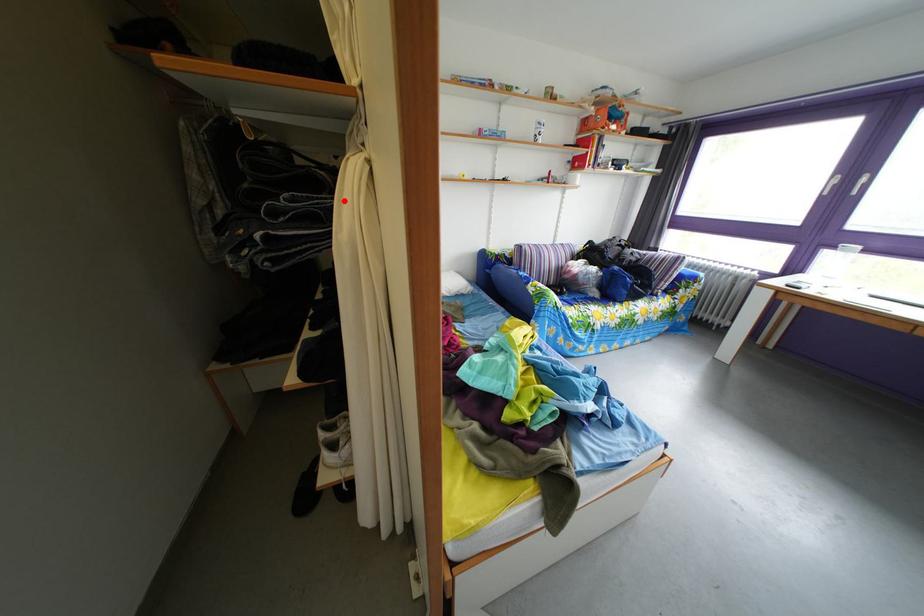
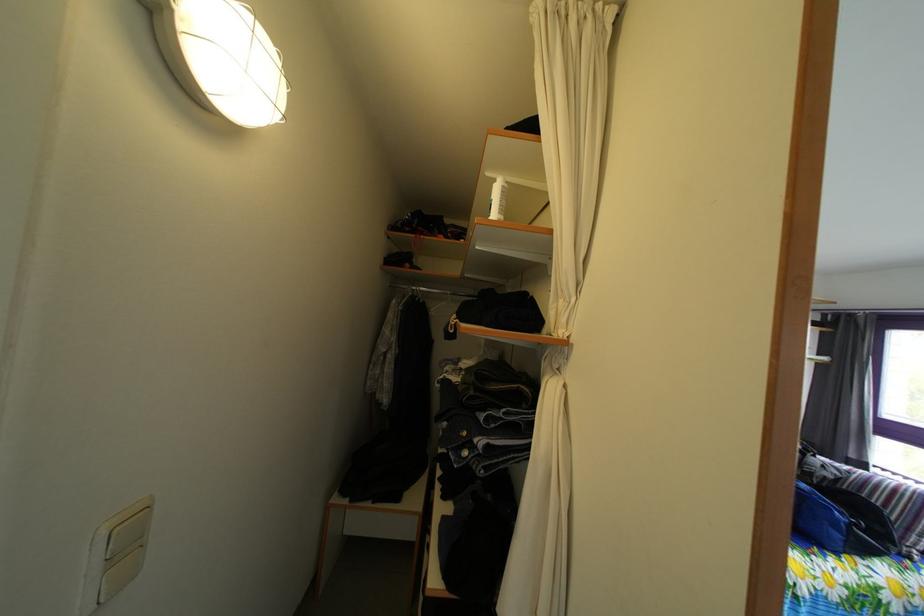
Where in the second image is the point corresponding to the highlighted location from the first image?

(545, 416)